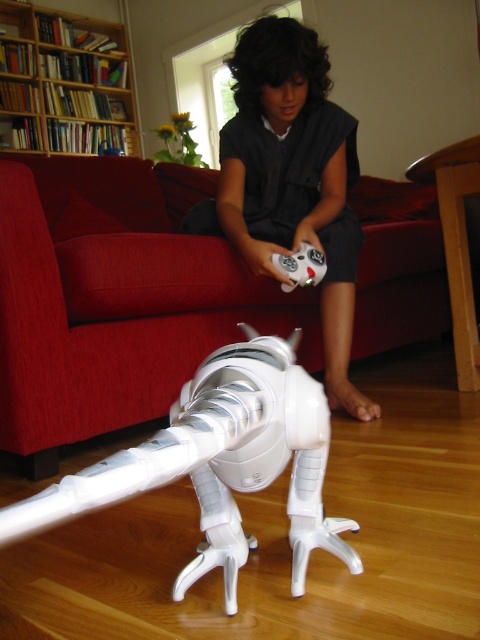
Does white plastic toy at lower center have a lesser height compared to wooden bookshelf at upper left?

Yes, white plastic toy at lower center is shorter than wooden bookshelf at upper left.

Between point (36, 522) and point (22, 33), which one is positioned behind?

The point (22, 33) is more distant.

Identify the location of white plastic toy at lower center. (219, 461).

Is dark gray fabric shirt at center smaller than wooden bookshelf at upper left?

Yes, dark gray fabric shirt at center is smaller than wooden bookshelf at upper left.

Which of these two, dark gray fabric shirt at center or wooden bookshelf at upper left, stands shorter?

dark gray fabric shirt at center

Who is more distant from viewer, [249,81] or [97,112]?

The point [97,112] is behind.

Where is `dark gray fabric shirt at center`? The height and width of the screenshot is (640, 480). dark gray fabric shirt at center is located at coordinates (290, 180).

Does red fabric couch at lower center appear on the left side of dark gray fabric shirt at center?

No, red fabric couch at lower center is not to the left of dark gray fabric shirt at center.

Between point (116, 422) and point (320, 241), which one is positioned in front?

Point (116, 422) is in front.

Locate an element on the screen. This screenshot has height=640, width=480. red fabric couch at lower center is located at coordinates (113, 304).

You are a GUI agent. You are given a task and a screenshot of the screen. Output one action in this format:
    pyautogui.click(x=<x>, y=<y>)
    Task: Click on the red fabric couch at lower center
    The width and height of the screenshot is (480, 640).
    Given the screenshot: What is the action you would take?
    pyautogui.click(x=113, y=304)